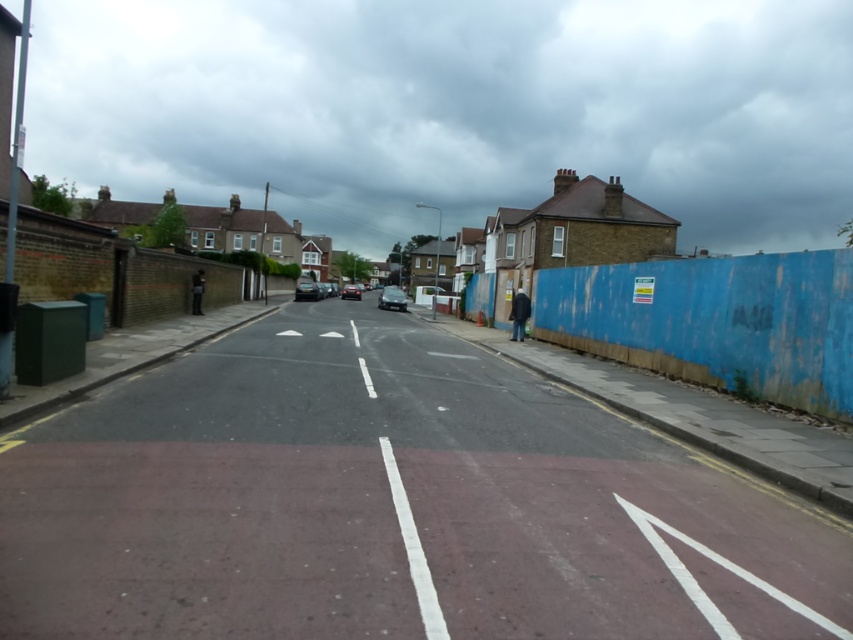
Who is more distant from viewer, [318,294] or [358,289]?

The point [358,289] is more distant.

Who is higher up, matte black car at center or shiny black car at center?

shiny black car at center is higher up.

The height and width of the screenshot is (640, 853). Find the location of `matte black car at center`. matte black car at center is located at coordinates (306, 291).

Identify the location of matte black car at center. (306, 291).

Measure the distance from metallic gray car at center to shiny black car at center.

metallic gray car at center and shiny black car at center are 30.61 feet apart.

Does metallic gray car at center appear on the left side of shiny black car at center?

In fact, metallic gray car at center is to the right of shiny black car at center.

You are a GUI agent. You are given a task and a screenshot of the screen. Output one action in this format:
    pyautogui.click(x=<x>, y=<y>)
    Task: Click on the metallic gray car at center
    
    Given the screenshot: What is the action you would take?
    click(x=392, y=298)

Which is in front, point (378, 307) or point (294, 291)?

Positioned in front is point (378, 307).

Who is more distant from viewer, [398,307] or [306,285]?

Positioned behind is point [306,285].

You are a GUI agent. You are given a task and a screenshot of the screen. Output one action in this format:
    pyautogui.click(x=<x>, y=<y>)
    Task: Click on the metallic gray car at center
    This screenshot has width=853, height=640.
    Given the screenshot: What is the action you would take?
    pyautogui.click(x=392, y=298)